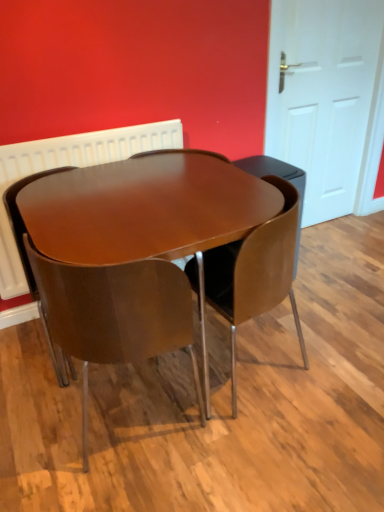
Question: In terms of height, does glossy wood chair at center, which is counted as the third chair, starting from the right, look taller or shorter compared to matte brown chair at center, the second chair when ordered from right to left?

Choices:
 (A) tall
 (B) short

Answer: (B)

Question: Is glossy wood chair at center, which is counted as the third chair, starting from the right, to the left or to the right of matte brown chair at center, the second chair when ordered from right to left, in the image?

Choices:
 (A) left
 (B) right

Answer: (A)

Question: Which is nearer to the glossy wood table at center?

Choices:
 (A) matte brown chair at center, the second chair when ordered from right to left
 (B) white glossy door at right
 (C) brown leather chair at center, which is the 3th chair from left to right
 (D) white plastic radiator at upper center
 (E) glossy wood chair at center, the first chair in the left-to-right sequence

Answer: (C)

Question: Which object is positioned closest to the glossy wood chair at center, the first chair in the left-to-right sequence?

Choices:
 (A) brown leather chair at center, which is counted as the first chair, starting from the right
 (B) white plastic radiator at upper center
 (C) white glossy door at right
 (D) matte brown chair at center, acting as the 2th chair starting from the left
 (E) glossy wood table at center

Answer: (B)